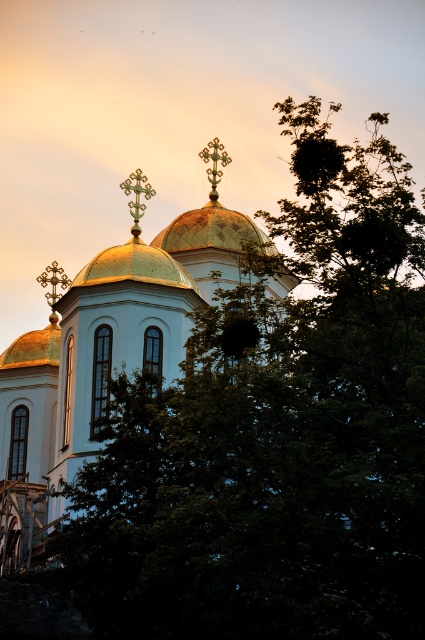
Does gold domed church at center appear on the right side of gold metallic cross at center?

In fact, gold domed church at center is to the left of gold metallic cross at center.

Between gold domed church at center and gold metallic cross at center, which one has more height?

gold domed church at center is taller.

Where is `gold domed church at center`? The image size is (425, 640). gold domed church at center is located at coordinates (104, 358).

The image size is (425, 640). I want to click on gold polished dome at upper left, so click(x=34, y=348).

Which is more to the right, gold polished dome at upper left or gold metallic cross at upper center?

gold metallic cross at upper center

Who is more distant from viewer, (34,340) or (141,186)?

Point (34,340)

You are a GUI agent. You are given a task and a screenshot of the screen. Output one action in this format:
    pyautogui.click(x=<x>, y=<y>)
    Task: Click on the gold polished dome at upper left
    The height and width of the screenshot is (640, 425).
    Given the screenshot: What is the action you would take?
    pyautogui.click(x=34, y=348)

Can you confirm if gold metallic cross at upper center is positioned above gold metallic cross at center?

No, gold metallic cross at upper center is not above gold metallic cross at center.

Who is positioned more to the left, gold metallic cross at upper center or gold metallic cross at center?

Positioned to the left is gold metallic cross at upper center.

This screenshot has width=425, height=640. Identify the location of gold metallic cross at upper center. (136, 196).